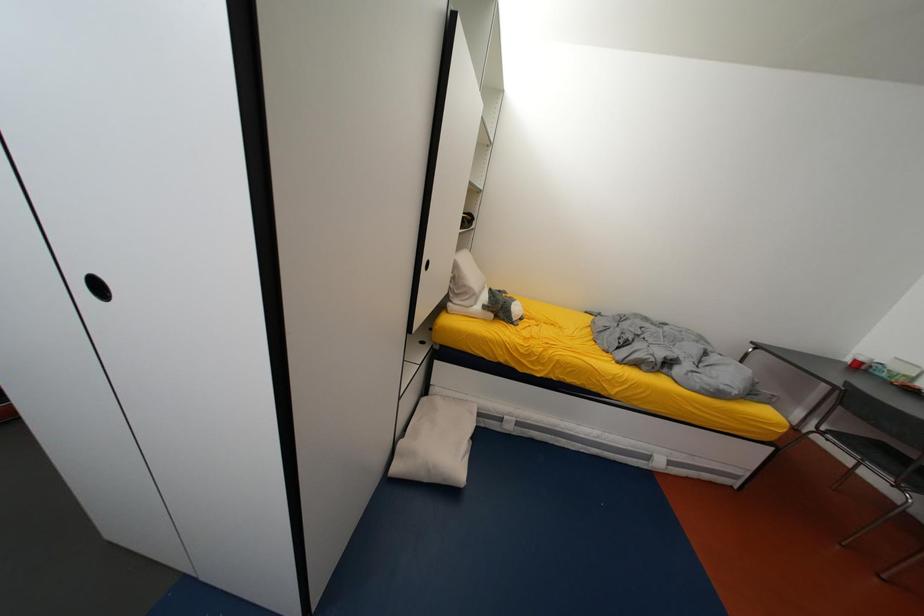
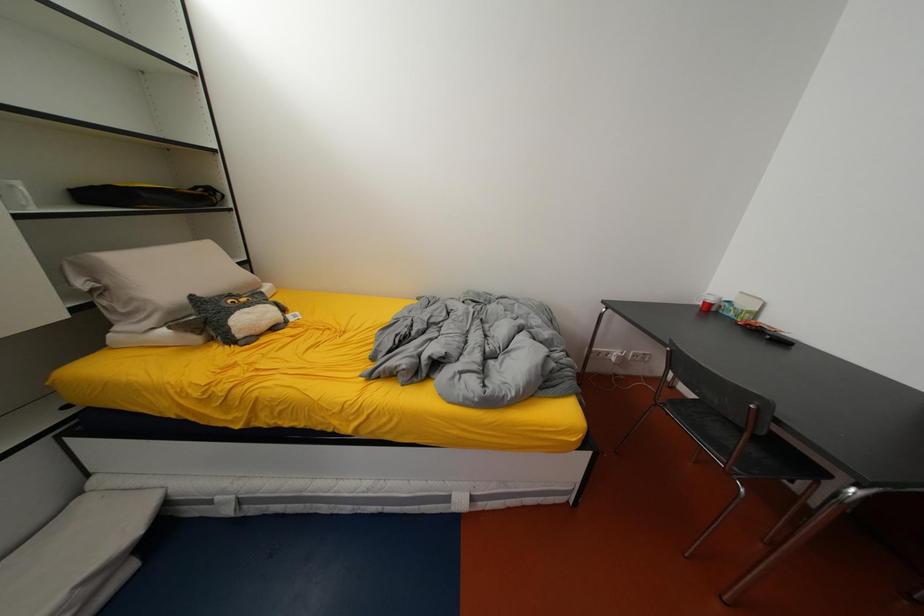
In a continuous first-person perspective shot, in which direction is the camera moving?

The movement direction of the cameraman is right, forward.